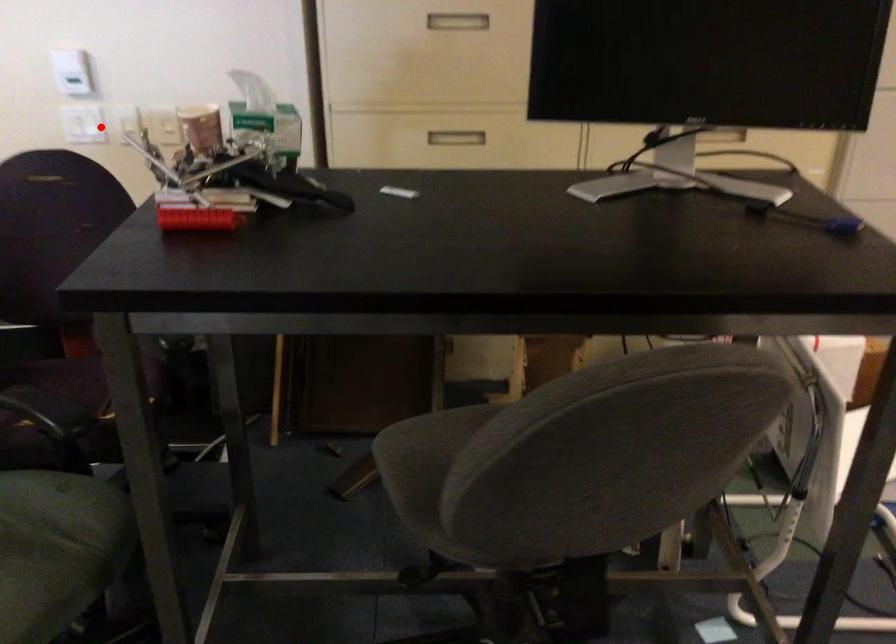
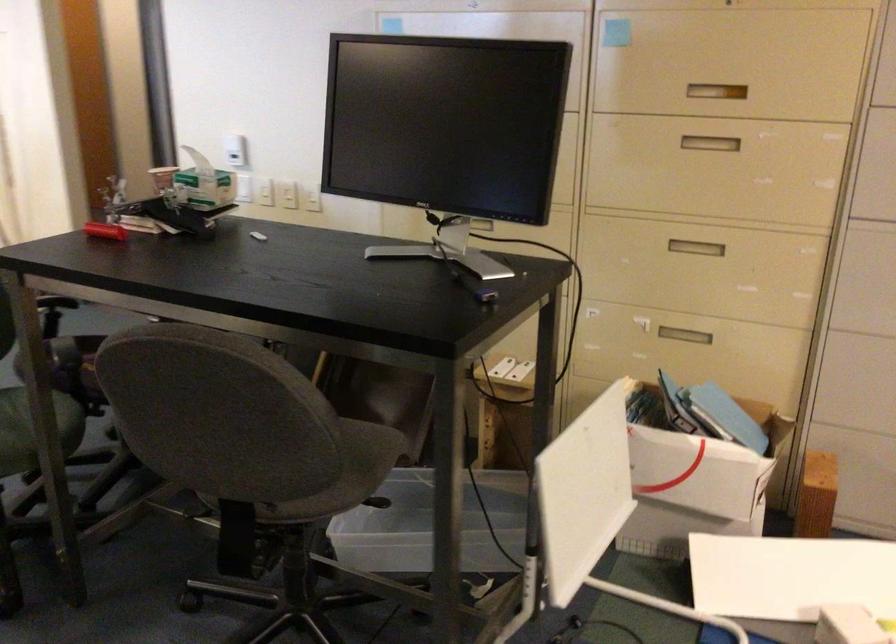
Locate, in the second image, the point that corresponds to the highlighted location in the first image.

(243, 187)